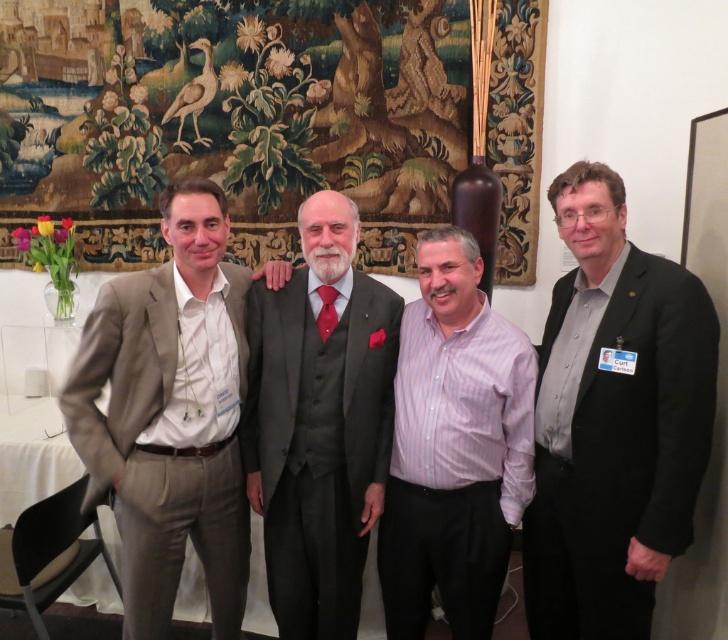
You are standing in the room where the four men are posing for a photo. You need to place a small sticker exactly at the point with coordinates (x=320, y=422). Which part of the scene should you place the sticker on?

The point with coordinates (x=320, y=422) is on the dark gray suit at center, so you should place the sticker there.